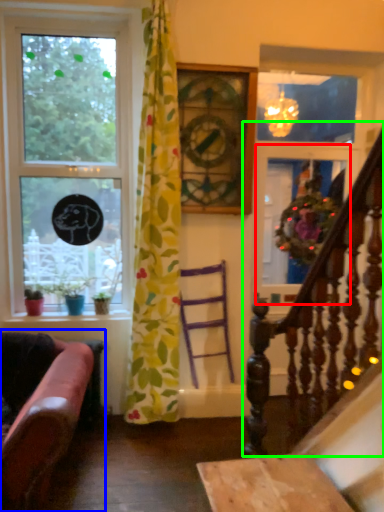
Question: Which object is positioned closest to glass door (highlighted by a red box)? Select from studio couch (highlighted by a blue box) and rail (highlighted by a green box).

Choices:
 (A) studio couch
 (B) rail

Answer: (B)